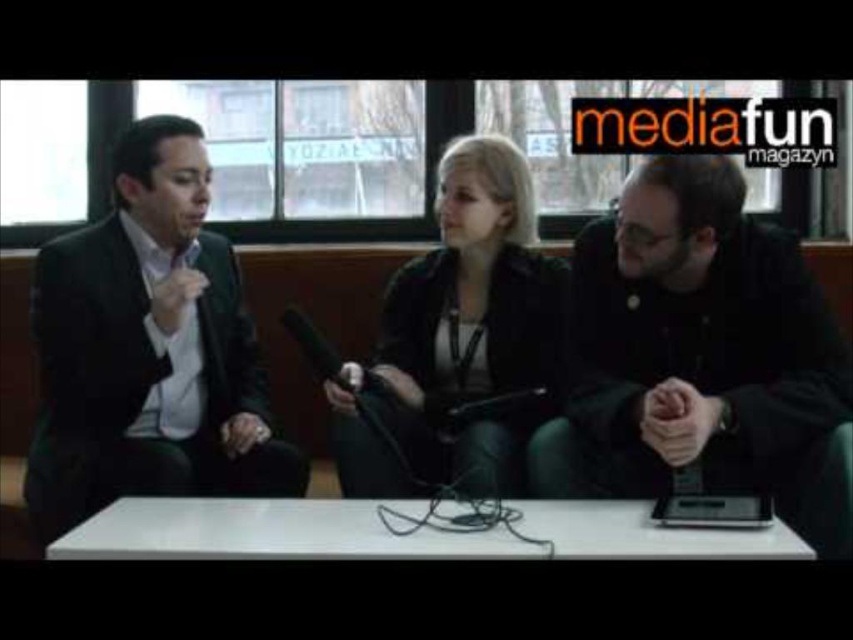
You are a photographer positioned behind the interviewer at center. You need to capture a photo that includes both the black matte jacket at right and the black suit at left. Which object should you adjust your camera angle to focus on first to ensure both are in frame?

The black matte jacket at right is below the black suit at left, so you should focus on the black suit at left first to ensure both are visible in the frame.

You are a photographer positioned behind the interviewer at the center table. You need to focus your camera on one of two points in the scene to capture a close shot. The points are point [631,401] and point [407,492]. Which point is closer to you?

Point [631,401] is closer to the viewer than point [407,492], so you should focus on point [631,401] for a closer shot.

You are a fashion designer observing the jackets in the image. You need to decide which jacket to recommend for a client who prefers a more relaxed fit. Which jacket between the black matte jacket at right and the black leather jacket at center should you suggest?

The black matte jacket at right is wider than the black leather jacket at center, so it would be more suitable for a relaxed fit.